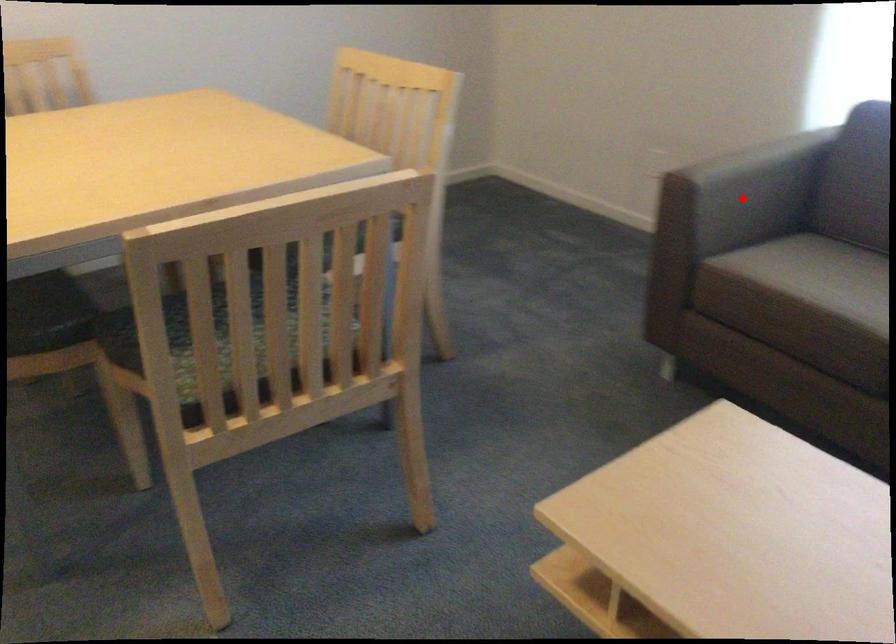
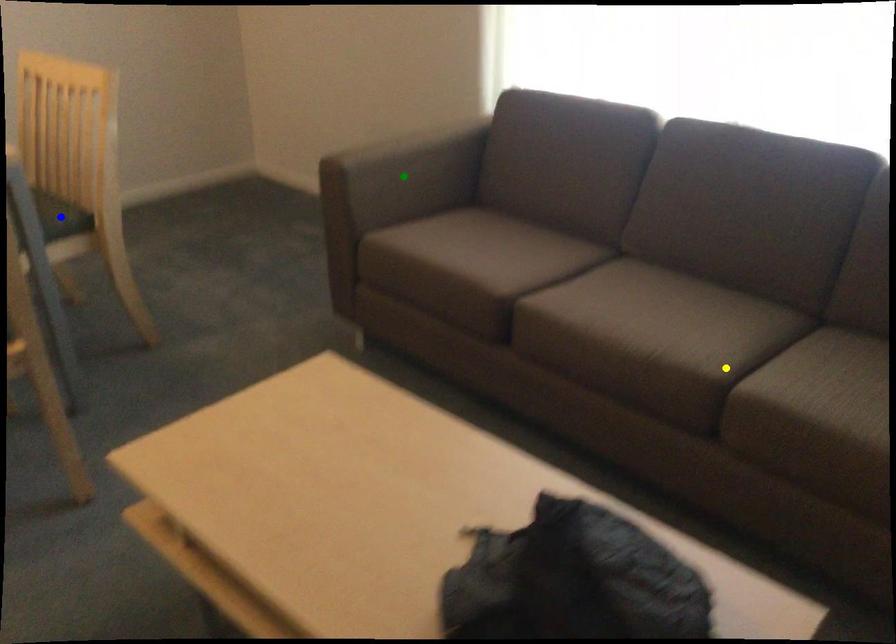
Question: I am providing you with two images of the same scene from different viewpoints. A red point is marked on the first image. You are given multiple points on the second image. Which mark in image 2 goes with the point in image 1?

Choices:
 (A) yellow point
 (B) blue point
 (C) green point

Answer: (C)